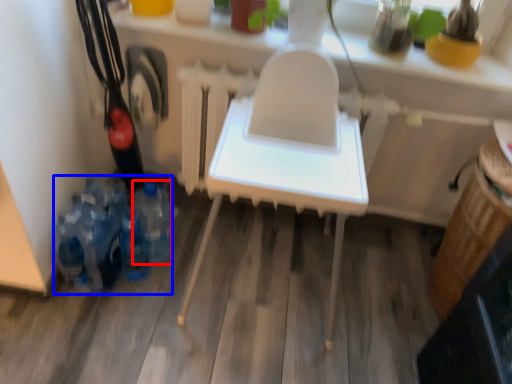
Question: Among these objects, which one is farthest to the camera, bottle (highlighted by a red box) or bottle (highlighted by a blue box)?

Choices:
 (A) bottle
 (B) bottle

Answer: (A)